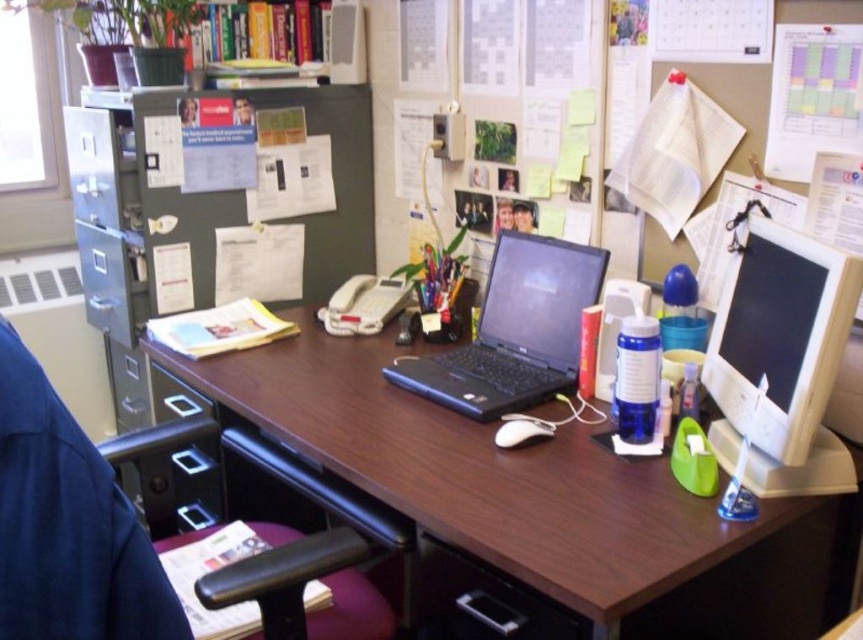
Question: Which point is closer to the camera?

Choices:
 (A) (180, 497)
 (B) (527, 336)
 (C) (184, 387)

Answer: (B)

Question: Which point is farther to the camera?

Choices:
 (A) dark blue fabric swivel chair at left
 (B) brown wood computer desk at center

Answer: (A)

Question: Can you confirm if brown wood computer desk at center is positioned to the left of matte plastic drawer at lower left?

Choices:
 (A) yes
 (B) no

Answer: (B)

Question: Is brown wood computer desk at center to the right of matte plastic drawer at lower left from the viewer's perspective?

Choices:
 (A) yes
 (B) no

Answer: (A)

Question: Does brown wood computer desk at center appear on the left side of matte black monitor at right?

Choices:
 (A) yes
 (B) no

Answer: (A)

Question: Which object is the farthest from the black plastic laptop at center?

Choices:
 (A) black plastic drawer at lower left
 (B) dark blue fabric swivel chair at left
 (C) matte plastic drawer at lower left
 (D) matte black monitor at right

Answer: (C)